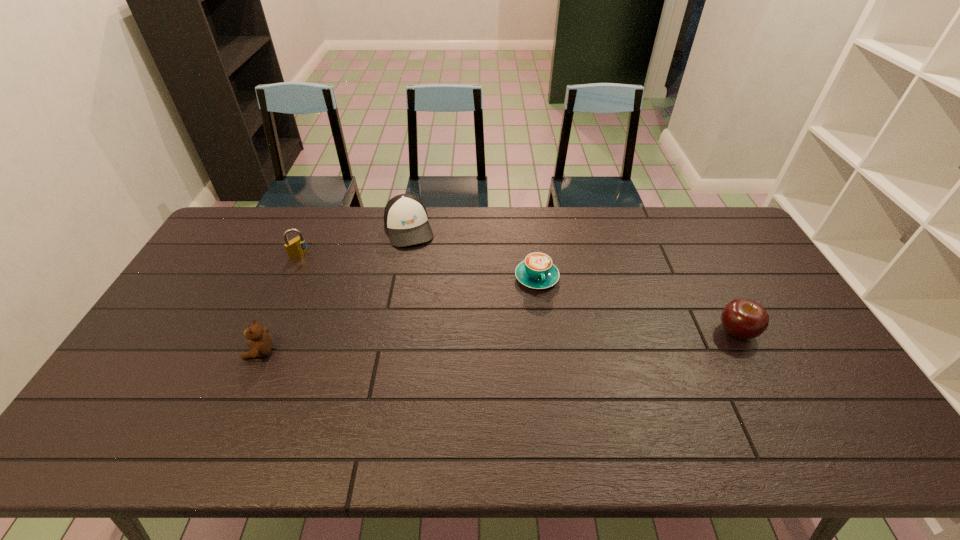
You are a GUI agent. You are given a task and a screenshot of the screen. Output one action in this format:
    pyautogui.click(x=<x>, y=<y>)
    Task: Click on the free space located on the side with the combination dials of the padlock
    The image size is (960, 540).
    Given the screenshot: What is the action you would take?
    pyautogui.click(x=333, y=273)

This screenshot has width=960, height=540. Identify the location of free spot located on the side with the combination dials of the padlock. (328, 271).

At what (x,y) coordinates should I click in order to perform the action: click on vacant space located 0.240m on the side with the combination dials of the padlock. Please return your answer as a coordinate pair (x, y). The width and height of the screenshot is (960, 540). Looking at the image, I should click on (357, 286).

Locate an element on the screen. free space located 0.370m with the handle on the right side of the shortest object is located at coordinates (581, 397).

Locate an element on the screen. Image resolution: width=960 pixels, height=540 pixels. vacant space located 0.150m with the handle on the right side of the shortest object is located at coordinates (556, 330).

Locate an element on the screen. Image resolution: width=960 pixels, height=540 pixels. free point located with the handle on the right side of the shortest object is located at coordinates (586, 408).

The image size is (960, 540). What are the coordinates of `vacant space positioned 0.390m on the front panel of the third object from left to right` in the screenshot? It's located at (442, 332).

The width and height of the screenshot is (960, 540). Identify the location of vacant region located 0.270m on the front panel of the third object from left to right. (432, 303).

The width and height of the screenshot is (960, 540). Identify the location of vacant area situated on the front panel of the third object from left to right. (443, 335).

Where is `object situated at the far edge`? The image size is (960, 540). object situated at the far edge is located at coordinates (405, 217).